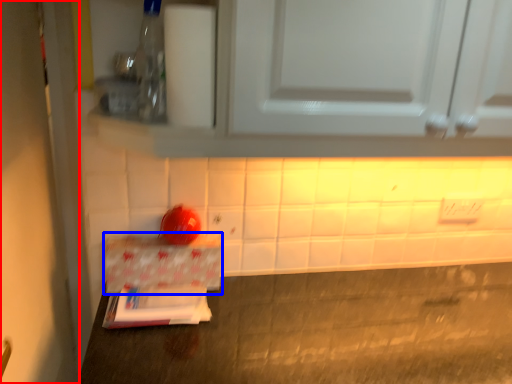
Question: Among these objects, which one is nearest to the camera, door (highlighted by a red box) or cardboard box (highlighted by a blue box)?

Choices:
 (A) door
 (B) cardboard box

Answer: (A)